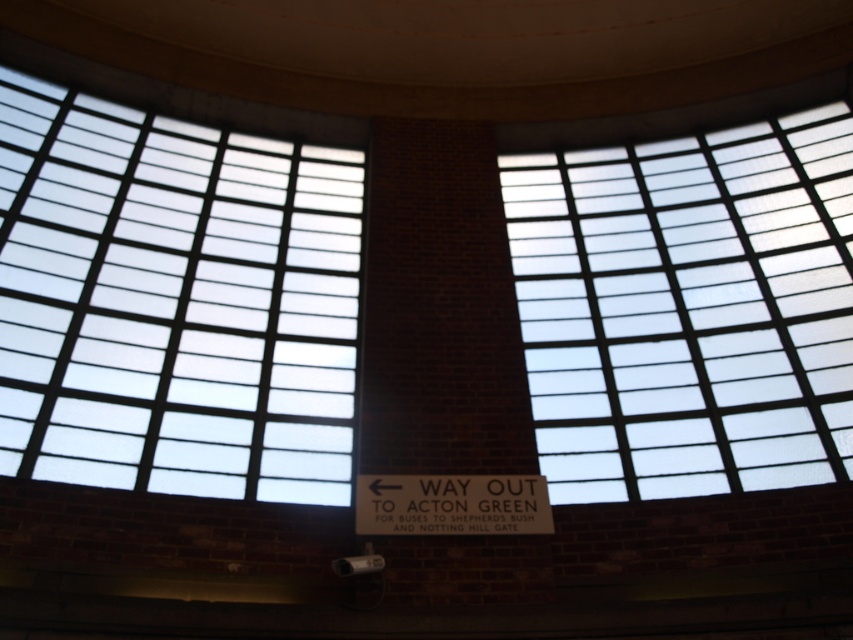
You are a delivery driver who needs to ensure your truck can fit through the clear glass window at upper left and the white matte sign at center. Based on the scene, which object has a greater width?

The clear glass window at upper left has a greater width than the white matte sign at center according to the description.

You are standing in front of the brick wall with two clear glass windows. The sign says to take the way out to Acton Green. Which window is taller, the clear glass window at upper left or the clear glass window at upper right?

The clear glass window at upper left is taller than the clear glass window at upper right.

You are standing in front of the brick wall and want to read the white matte sign at center. Can you see the sign clearly through the clear glass window at upper left?

The white matte sign at center is behind the clear glass window at upper left, so yes, you can see the sign clearly through the clear glass window at upper left.